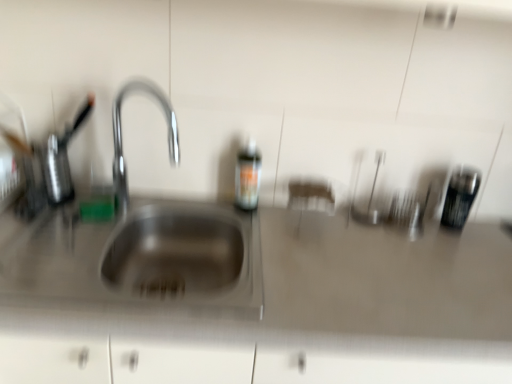
Question: Considering the relative positions of metallic black canister at right and translucent plastic bottle at center in the image provided, is metallic black canister at right in front of translucent plastic bottle at center?

Choices:
 (A) yes
 (B) no

Answer: (B)

Question: Is metallic black canister at right not inside translucent plastic bottle at center?

Choices:
 (A) yes
 (B) no

Answer: (A)

Question: Can you confirm if metallic black canister at right is wider than translucent plastic bottle at center?

Choices:
 (A) yes
 (B) no

Answer: (A)

Question: Is translucent plastic bottle at center inside metallic black canister at right?

Choices:
 (A) no
 (B) yes

Answer: (A)

Question: Is metallic black canister at right to the left of translucent plastic bottle at center from the viewer's perspective?

Choices:
 (A) no
 (B) yes

Answer: (A)

Question: In terms of width, does stainless steel sink at left look wider or thinner when compared to translucent plastic bottle at center?

Choices:
 (A) thin
 (B) wide

Answer: (B)

Question: Would you say stainless steel sink at left is inside or outside translucent plastic bottle at center?

Choices:
 (A) outside
 (B) inside

Answer: (A)

Question: Considering their positions, is stainless steel sink at left located in front of or behind translucent plastic bottle at center?

Choices:
 (A) behind
 (B) front

Answer: (B)

Question: Is point (114, 122) closer or farther from the camera than point (244, 157)?

Choices:
 (A) farther
 (B) closer

Answer: (B)

Question: From a real-world perspective, is satin steel sink at center positioned above or below stainless steel sink at left?

Choices:
 (A) above
 (B) below

Answer: (B)

Question: Considering their positions, is satin steel sink at center located in front of or behind stainless steel sink at left?

Choices:
 (A) behind
 (B) front

Answer: (A)

Question: Is satin steel sink at center inside the boundaries of stainless steel sink at left, or outside?

Choices:
 (A) outside
 (B) inside

Answer: (A)

Question: Based on their sizes in the image, would you say satin steel sink at center is bigger or smaller than stainless steel sink at left?

Choices:
 (A) small
 (B) big

Answer: (B)

Question: In the image, is stainless steel sink at left positioned in front of or behind metallic black canister at right?

Choices:
 (A) front
 (B) behind

Answer: (A)

Question: From the image's perspective, is stainless steel sink at left located above or below metallic black canister at right?

Choices:
 (A) above
 (B) below

Answer: (B)